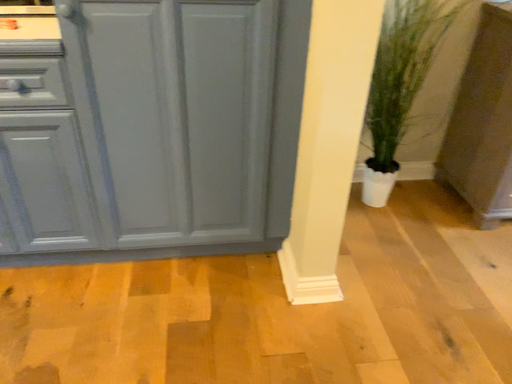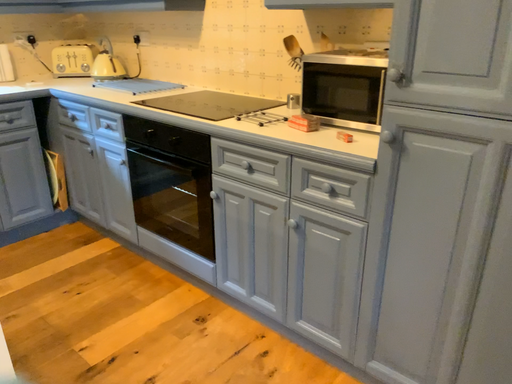
Question: How did the camera likely rotate when shooting the video?

Choices:
 (A) rotated right
 (B) rotated left

Answer: (B)